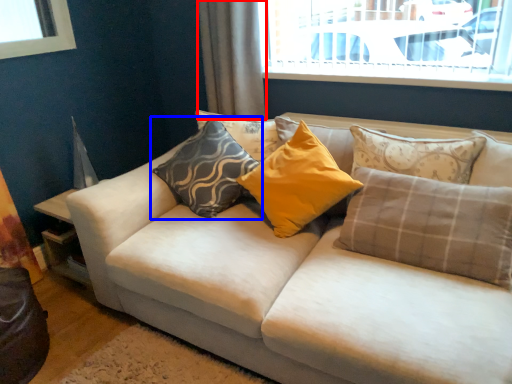
Question: Which object appears farthest to the camera in this image, curtain (highlighted by a red box) or pillow (highlighted by a blue box)?

Choices:
 (A) curtain
 (B) pillow

Answer: (A)